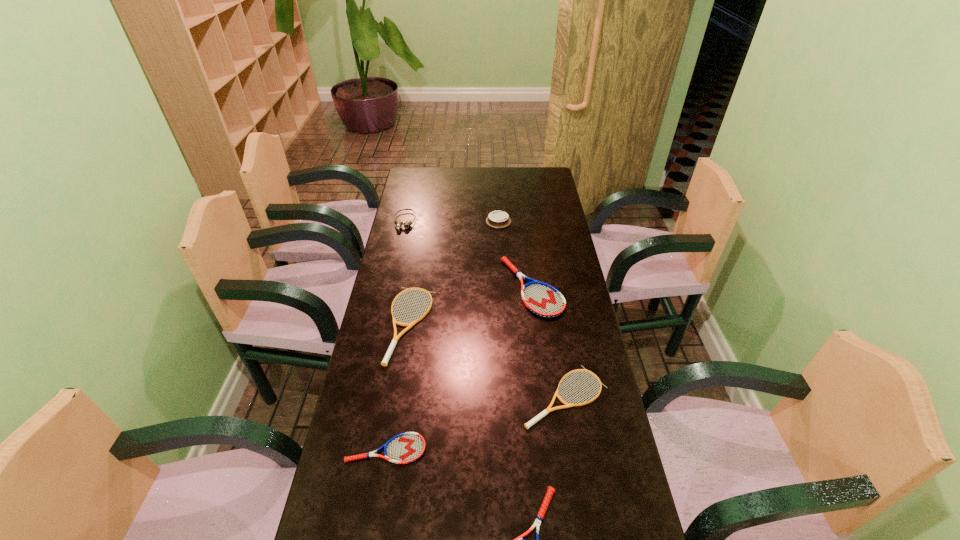
The image size is (960, 540). I want to click on chocolate cake, so click(x=498, y=219).

This screenshot has width=960, height=540. Identify the location of goggles. tap(399, 224).

What are the coordinates of `the biggest blue tennis racket` in the screenshot? It's located at (542, 299).

This screenshot has height=540, width=960. I want to click on the left beige tennis racket, so click(x=395, y=339).

Where is `the right beige tennis racket`? The height and width of the screenshot is (540, 960). the right beige tennis racket is located at coordinates point(527,425).

Find the location of a particular element. Image resolution: width=960 pixels, height=540 pixels. the shortest object is located at coordinates (407, 447).

This screenshot has height=540, width=960. I want to click on the leftmost blue tennis racket, so click(407, 447).

I want to click on vacant area located 0.180m on the left of the chocolate cake, so click(x=444, y=221).

I want to click on free location located 0.230m on the front lenses and sides of the goggles, so click(395, 268).

This screenshot has width=960, height=540. Identify the location of vacant area situated 0.360m on the left of the farthest blue tennis racket. (403, 287).